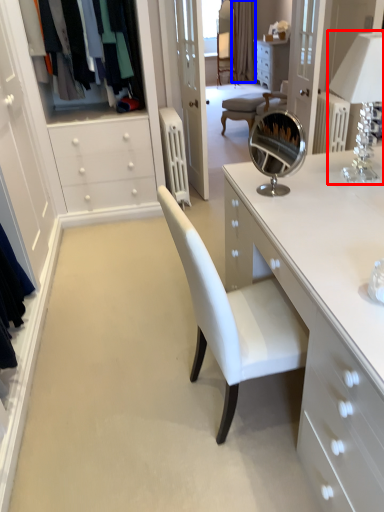
Question: Which point is closer to the camera, table lamp (highlighted by a red box) or curtain (highlighted by a blue box)?

Choices:
 (A) table lamp
 (B) curtain

Answer: (A)